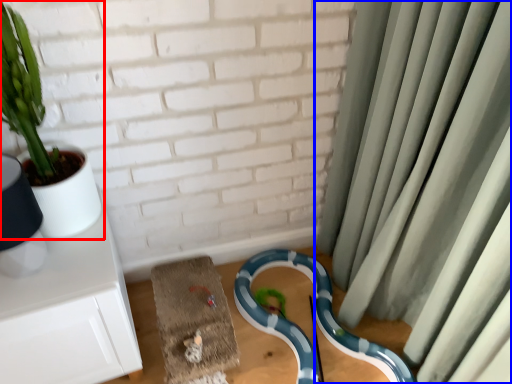
Question: Which of the following is the closest to the observer, houseplant (highlighted by a red box) or curtain (highlighted by a blue box)?

Choices:
 (A) houseplant
 (B) curtain

Answer: (B)